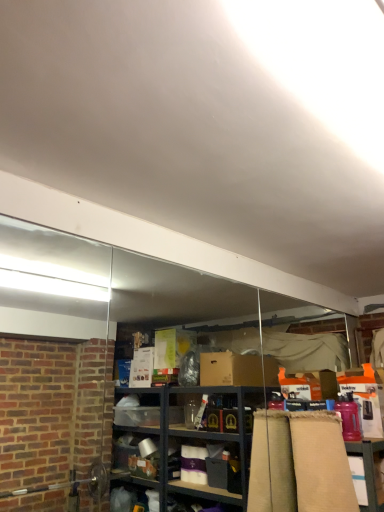
This screenshot has height=512, width=384. Describe the element at coordinates (300, 464) in the screenshot. I see `beige fabric at right` at that location.

In order to face beige fabric at right, should I rotate leftwards or rightwards?

Rotate right and turn 18.182 degrees.

Image resolution: width=384 pixels, height=512 pixels. What are the coordinates of `beige fabric at right` in the screenshot? It's located at (300, 464).

What is the approximate height of beige fabric at right?

beige fabric at right is 22.70 inches in height.

Looking at this image, measure the distance between point (x=283, y=459) and camera.

They are 7.93 feet apart.

Image resolution: width=384 pixels, height=512 pixels. What do you see at coordinates (367, 472) in the screenshot?
I see `matte cardboard table at lower right` at bounding box center [367, 472].

Image resolution: width=384 pixels, height=512 pixels. I want to click on matte cardboard table at lower right, so tap(367, 472).

You are a GUI agent. You are given a task and a screenshot of the screen. Output one action in this format:
    pyautogui.click(x=<x>, y=<y>)
    Task: Click on the beige fabric at right
    This screenshot has width=384, height=512.
    Given the screenshot: What is the action you would take?
    pyautogui.click(x=300, y=464)

Between beige fabric at right and matte cardboard table at lower right, which one appears on the left side from the viewer's perspective?

From the viewer's perspective, beige fabric at right appears more on the left side.

Which is behind, beige fabric at right or matte cardboard table at lower right?

matte cardboard table at lower right.

Which is nearer, (338, 447) or (365, 476)?

Point (338, 447)

From the image's perspective, is beige fabric at right positioned above or below matte cardboard table at lower right?

From the image's perspective, beige fabric at right appears above matte cardboard table at lower right.

From a real-world perspective, is beige fabric at right positioned above or below matte cardboard table at lower right?

beige fabric at right is situated higher than matte cardboard table at lower right in the real world.

Considering the relative sizes of beige fabric at right and matte cardboard table at lower right in the image provided, is beige fabric at right thinner than matte cardboard table at lower right?

No.

Which of these two, beige fabric at right or matte cardboard table at lower right, stands shorter?

Standing shorter between the two is matte cardboard table at lower right.

Considering the sizes of objects beige fabric at right and matte cardboard table at lower right in the image provided, who is bigger, beige fabric at right or matte cardboard table at lower right?

With larger size is beige fabric at right.

Which is correct: beige fabric at right is inside matte cardboard table at lower right, or outside of it?

beige fabric at right is not inside matte cardboard table at lower right, it's outside.

Is there a large distance between beige fabric at right and matte cardboard table at lower right?

That's not correct — beige fabric at right is a little close to matte cardboard table at lower right.

Could you tell me if beige fabric at right is facing matte cardboard table at lower right?

No, beige fabric at right does not turn towards matte cardboard table at lower right.

Looking at this image, can you tell me how much beige fabric at right and matte cardboard table at lower right differ in facing direction?

The facing directions of beige fabric at right and matte cardboard table at lower right are 1.03 degrees apart.

There is a matte cardboard table at lower right. Identify the location of curtain above it (from a real-world perspective). The width and height of the screenshot is (384, 512). (300, 464).

Which object is positioned more to the right, matte cardboard table at lower right or beige fabric at right?

matte cardboard table at lower right.

Between matte cardboard table at lower right and beige fabric at right, which one is positioned behind?

matte cardboard table at lower right is further away from the camera.

Does point (356, 476) lie in front of point (292, 499)?

No, it is not.

From the image's perspective, is matte cardboard table at lower right located above beige fabric at right?

No, from the image's perspective, matte cardboard table at lower right is not above beige fabric at right.

From a real-world perspective, is matte cardboard table at lower right on top of beige fabric at right?

No, from a real-world perspective, matte cardboard table at lower right is not on top of beige fabric at right.

Which object is wider, matte cardboard table at lower right or beige fabric at right?

With larger width is beige fabric at right.

Considering the relative sizes of matte cardboard table at lower right and beige fabric at right in the image provided, is matte cardboard table at lower right shorter than beige fabric at right?

Indeed, matte cardboard table at lower right has a lesser height compared to beige fabric at right.

Which of these two, matte cardboard table at lower right or beige fabric at right, is smaller?

matte cardboard table at lower right.

Is matte cardboard table at lower right not inside beige fabric at right?

matte cardboard table at lower right is positioned outside beige fabric at right.

Is matte cardboard table at lower right touching beige fabric at right?

matte cardboard table at lower right is not next to beige fabric at right, and they're not touching.

Is beige fabric at right at the back of matte cardboard table at lower right?

That's not correct — matte cardboard table at lower right is not looking away from beige fabric at right.

How different are the orientations of matte cardboard table at lower right and beige fabric at right in degrees?

1.03 degrees separate the facing orientations of matte cardboard table at lower right and beige fabric at right.

The image size is (384, 512). I want to click on curtain positioned vertically above the matte cardboard table at lower right (from a real-world perspective), so click(300, 464).

Identify the location of curtain in front of the matte cardboard table at lower right. (300, 464).

In order to click on table lying behind the beige fabric at right in this screenshot , I will do `click(367, 472)`.